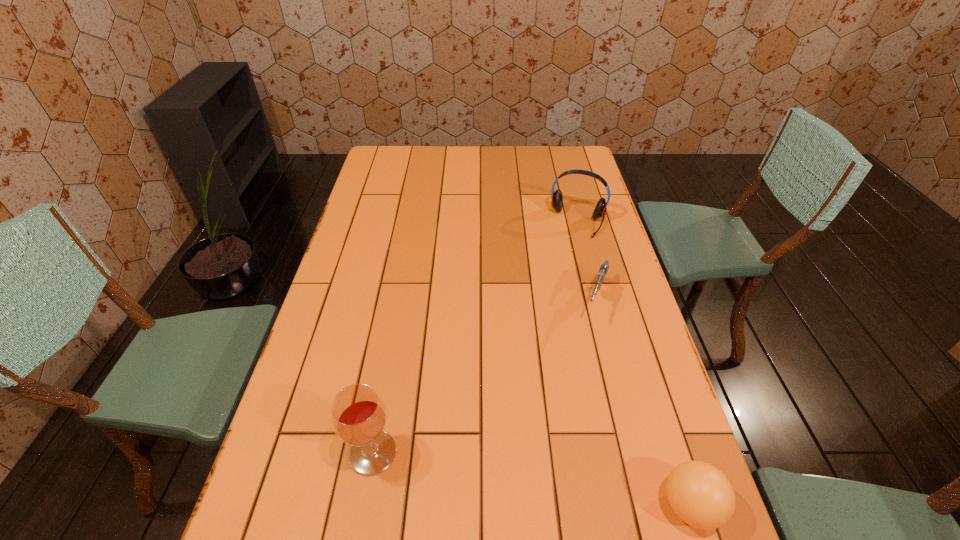
In the image, there is a desktop. Where is `vacant region at the far left corner`? vacant region at the far left corner is located at coordinates (381, 173).

The image size is (960, 540). What are the coordinates of `vacant space at the far right corner of the desktop` in the screenshot? It's located at [583, 159].

Locate an element on the screen. The height and width of the screenshot is (540, 960). free space between the farthest object and the leftmost object is located at coordinates (475, 337).

I want to click on vacant point located between the leftmost object and the third nearest object, so click(x=484, y=376).

The height and width of the screenshot is (540, 960). In order to click on vacant space that is in between the ping-pong ball and the farthest object in this screenshot , I will do `click(635, 363)`.

Locate an element on the screen. The height and width of the screenshot is (540, 960). empty space between the gun and the headset is located at coordinates (587, 261).

This screenshot has height=540, width=960. Identify the location of vacant area between the farthest object and the leftmost object. (475, 337).

This screenshot has width=960, height=540. I want to click on free area in between the second farthest object and the ping-pong ball, so [642, 403].

At what (x,y) coordinates should I click in order to perform the action: click on empty space between the farthest object and the ping-pong ball. Please return your answer as a coordinate pair (x, y). The image size is (960, 540). Looking at the image, I should click on (635, 363).

Identify the location of free area in between the leftmost object and the third nearest object. (484, 376).